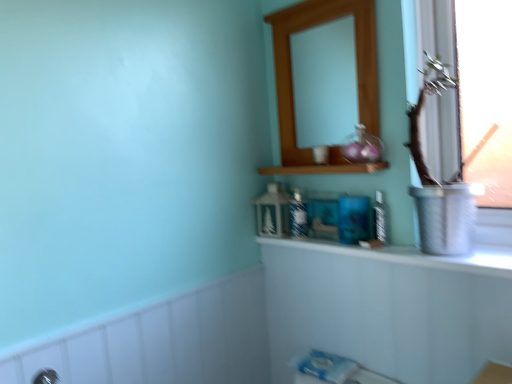
Where is `empty space that is in between metallic silver vase at right and clear plastic bottle at center, which appears as the second toiletry when viewed from the back`? This screenshot has width=512, height=384. empty space that is in between metallic silver vase at right and clear plastic bottle at center, which appears as the second toiletry when viewed from the back is located at coordinates (395, 244).